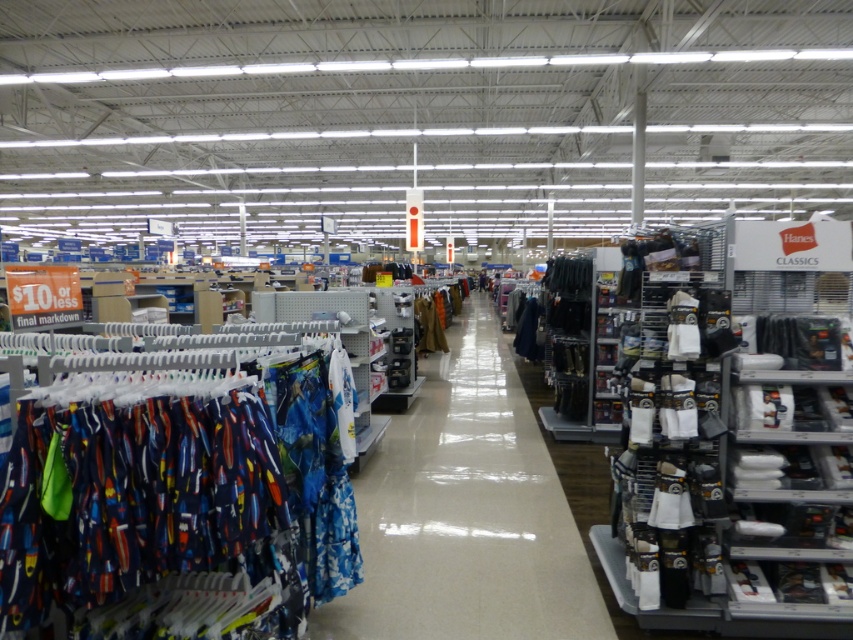
You are a customer in the store and want to reach the brown leather jacket at center. However, the printed cotton shorts at left are blocking your path. Can you walk around them easily?

The printed cotton shorts at left is much taller than brown leather jacket at center, so it might block your path. You might need to move around the sides or ask for assistance to access the brown leather jacket at center.

You are a customer in the store looking at the blue fabric shirts at center and the brown leather jacket at center. Which item is positioned lower in the display?

The blue fabric shirts at center is positioned below the brown leather jacket at center, so it is lower in the display.